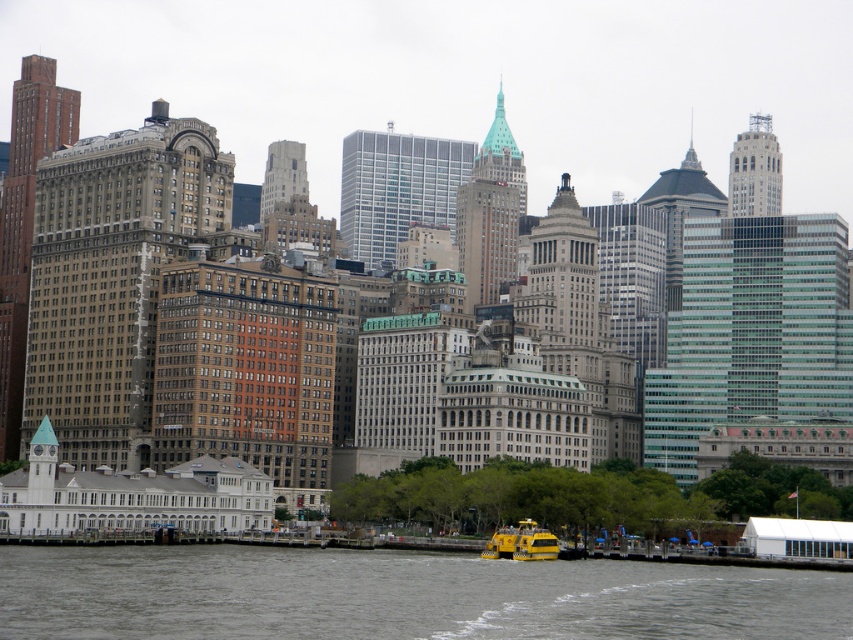
Locate an element on the screen. gray water at lower center is located at coordinates (399, 595).

Does gray water at lower center appear on the left side of yellow rubber boat at lower center?

Yes, gray water at lower center is to the left of yellow rubber boat at lower center.

Who is more forward, (444,573) or (532,550)?

Positioned in front is point (444,573).

The image size is (853, 640). Find the location of `gray water at lower center`. gray water at lower center is located at coordinates (399, 595).